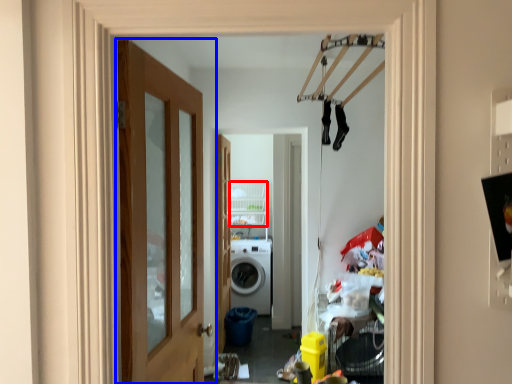
Question: Which object appears closest to the camera in this image, shelf (highlighted by a red box) or door (highlighted by a blue box)?

Choices:
 (A) shelf
 (B) door

Answer: (B)